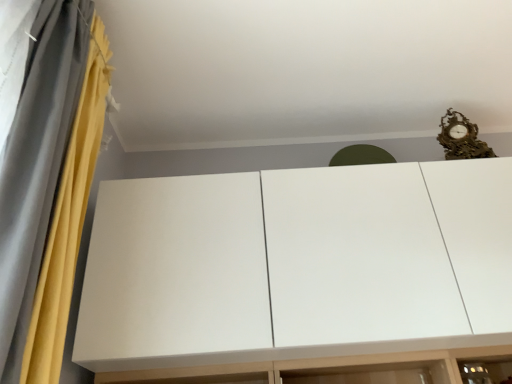
Question: Is yellow fabric curtain at left positioned in front of white matte cupboard at upper center?

Choices:
 (A) no
 (B) yes

Answer: (B)

Question: Is yellow fabric curtain at left positioned beyond the bounds of white matte cupboard at upper center?

Choices:
 (A) no
 (B) yes

Answer: (B)

Question: Considering the relative sizes of yellow fabric curtain at left and white matte cupboard at upper center in the image provided, is yellow fabric curtain at left thinner than white matte cupboard at upper center?

Choices:
 (A) no
 (B) yes

Answer: (B)

Question: Does yellow fabric curtain at left have a smaller size compared to white matte cupboard at upper center?

Choices:
 (A) no
 (B) yes

Answer: (B)

Question: Considering the relative sizes of yellow fabric curtain at left and white matte cupboard at upper center in the image provided, is yellow fabric curtain at left bigger than white matte cupboard at upper center?

Choices:
 (A) no
 (B) yes

Answer: (A)

Question: From the image's perspective, is yellow fabric curtain at left on white matte cupboard at upper center?

Choices:
 (A) yes
 (B) no

Answer: (A)

Question: Does white matte cupboard at upper center have a greater height compared to yellow fabric curtain at left?

Choices:
 (A) yes
 (B) no

Answer: (B)

Question: Is white matte cupboard at upper center far away from yellow fabric curtain at left?

Choices:
 (A) no
 (B) yes

Answer: (A)

Question: Considering the relative positions of white matte cupboard at upper center and yellow fabric curtain at left in the image provided, is white matte cupboard at upper center behind yellow fabric curtain at left?

Choices:
 (A) yes
 (B) no

Answer: (A)

Question: Is white matte cupboard at upper center outside of yellow fabric curtain at left?

Choices:
 (A) yes
 (B) no

Answer: (A)

Question: From the image's perspective, is white matte cupboard at upper center on top of yellow fabric curtain at left?

Choices:
 (A) yes
 (B) no

Answer: (B)

Question: From the image's perspective, is white matte cupboard at upper center beneath yellow fabric curtain at left?

Choices:
 (A) yes
 (B) no

Answer: (A)

Question: Looking at their shapes, would you say yellow fabric curtain at left is wider or thinner than white matte cupboard at upper center?

Choices:
 (A) wide
 (B) thin

Answer: (B)